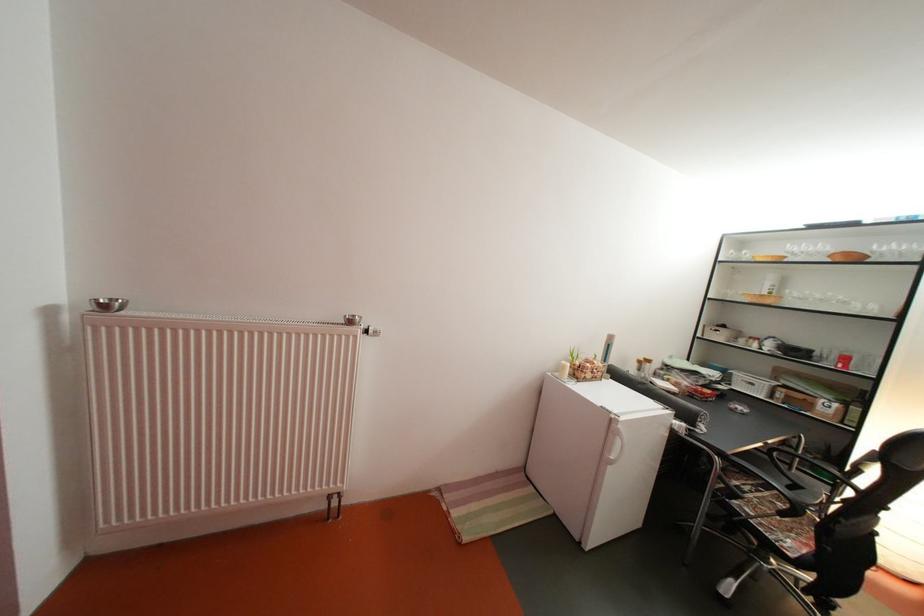
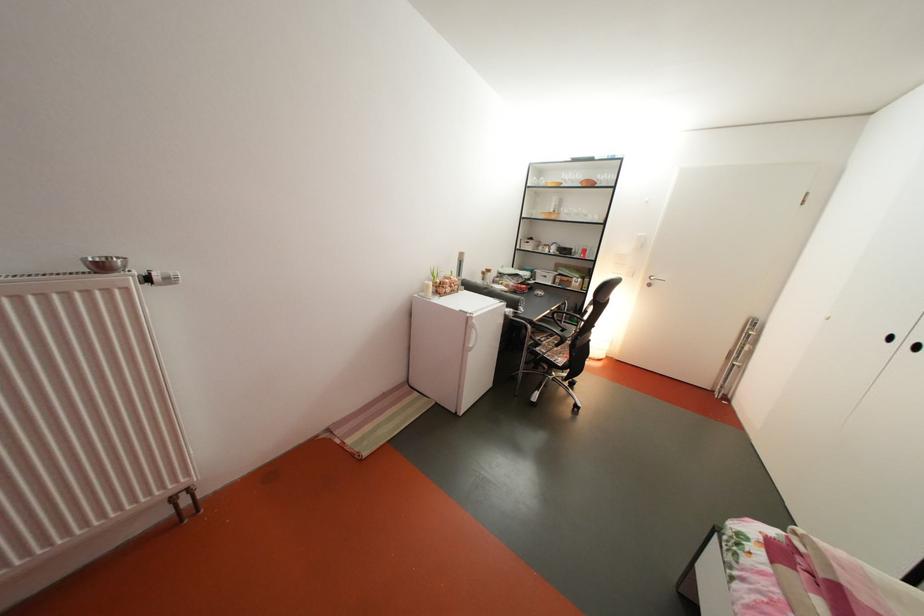
Locate, in the second image, the point that corresponds to point 575,373 in the first image.

(439, 293)